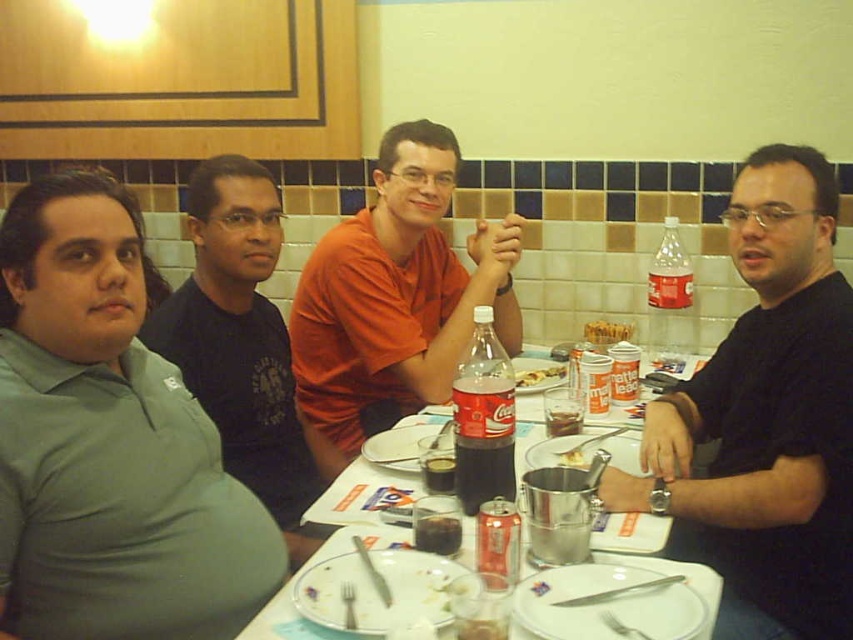
Question: Where is dark red glass coca-cola at center located in relation to dark brown glass at table center in the image?

Choices:
 (A) left
 (B) right

Answer: (A)

Question: Is black matte shirt at right to the right of dark brown glass at table center from the viewer's perspective?

Choices:
 (A) yes
 (B) no

Answer: (A)

Question: Based on their relative distances, which object is farther from the green matte shirt at left?

Choices:
 (A) golden brown bread at center
 (B) dark brown liquid at table center
 (C) white porcelain bowl at center

Answer: (A)

Question: Which object is positioned closest to the golden brown bread at center?

Choices:
 (A) dark brown glass at table center
 (B) dark red glass coca-cola at center

Answer: (A)

Question: Does dark brown glass at table center have a greater width compared to white porcelain bowl at center?

Choices:
 (A) yes
 (B) no

Answer: (A)

Question: Which object is positioned farthest from the golden brown bread at center?

Choices:
 (A) green matte shirt at left
 (B) yellowish matte plate at center

Answer: (A)